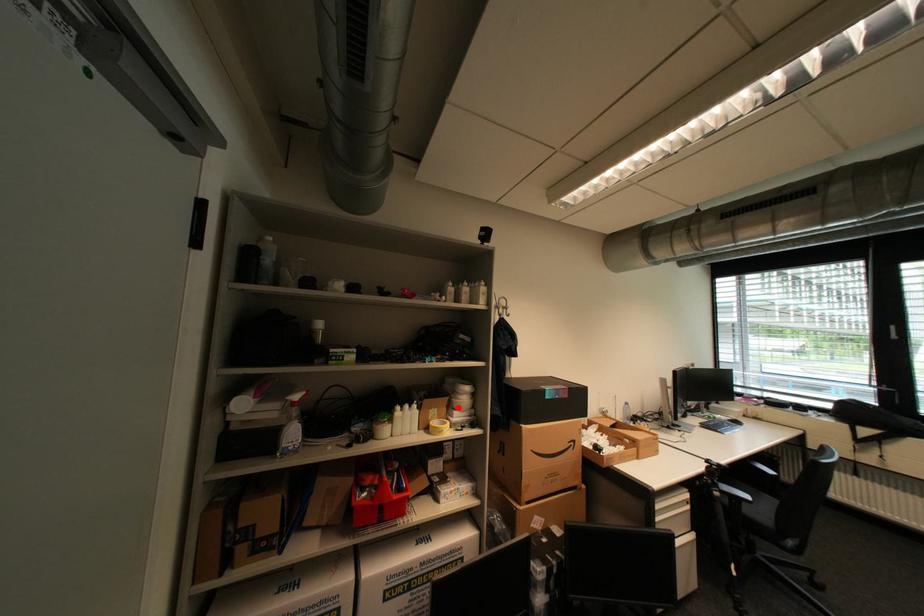
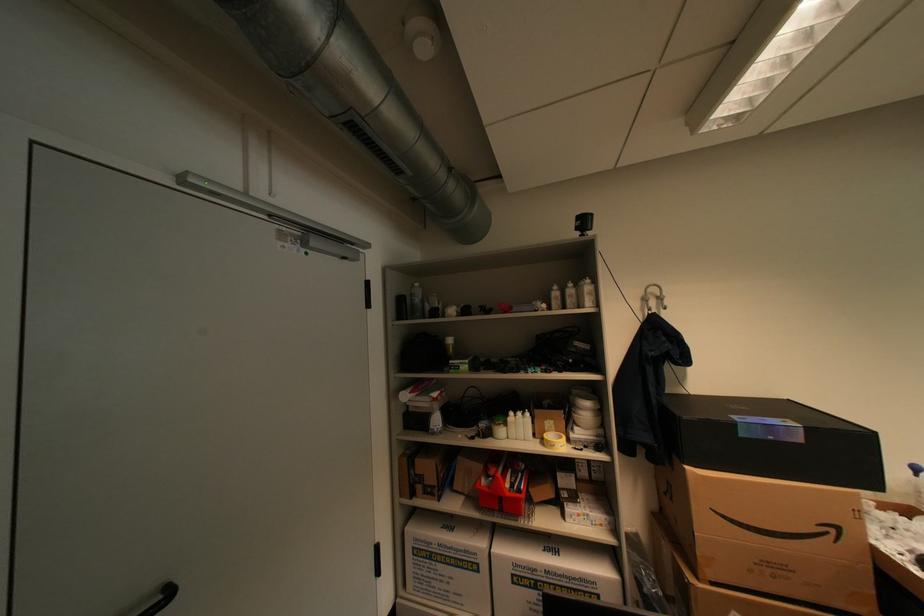
Question: I am providing you with two images of the same scene from different viewpoints. A red point is marked on the first image. At the location where the point appears in image 1, is it still visible in image 2?

Choices:
 (A) Yes
 (B) No

Answer: (A)